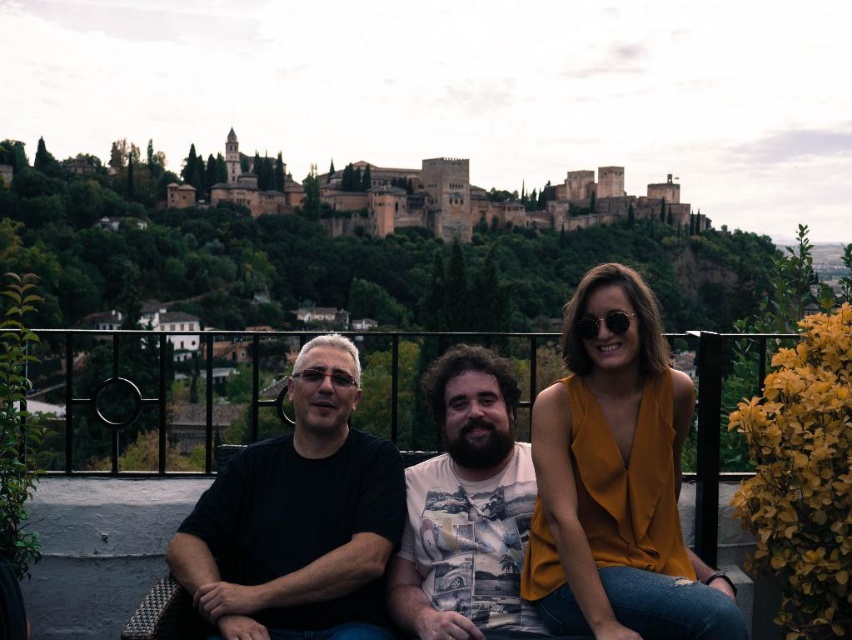
Can you confirm if mustard fabric blouse at center is positioned above white printed t-shirt at center?

Incorrect, mustard fabric blouse at center is not positioned above white printed t-shirt at center.

Does mustard fabric blouse at center have a smaller size compared to white printed t-shirt at center?

Actually, mustard fabric blouse at center might be larger than white printed t-shirt at center.

Who is more distant from viewer, (613, 552) or (502, 451)?

The point (502, 451) is behind.

This screenshot has width=852, height=640. I want to click on mustard fabric blouse at center, so click(614, 477).

Is point (632, 337) positioned in front of point (234, 595)?

No, it is behind (234, 595).

The width and height of the screenshot is (852, 640). Describe the element at coordinates (614, 477) in the screenshot. I see `mustard fabric blouse at center` at that location.

This screenshot has height=640, width=852. Identify the location of mustard fabric blouse at center. (614, 477).

Does point (320, 360) lie in front of point (141, 472)?

Yes, it is.

Can you confirm if black matte shirt at center is shorter than black metal railing at center?

Incorrect, black matte shirt at center's height does not fall short of black metal railing at center's.

This screenshot has width=852, height=640. What are the coordinates of `black matte shirt at center` in the screenshot? It's located at (298, 518).